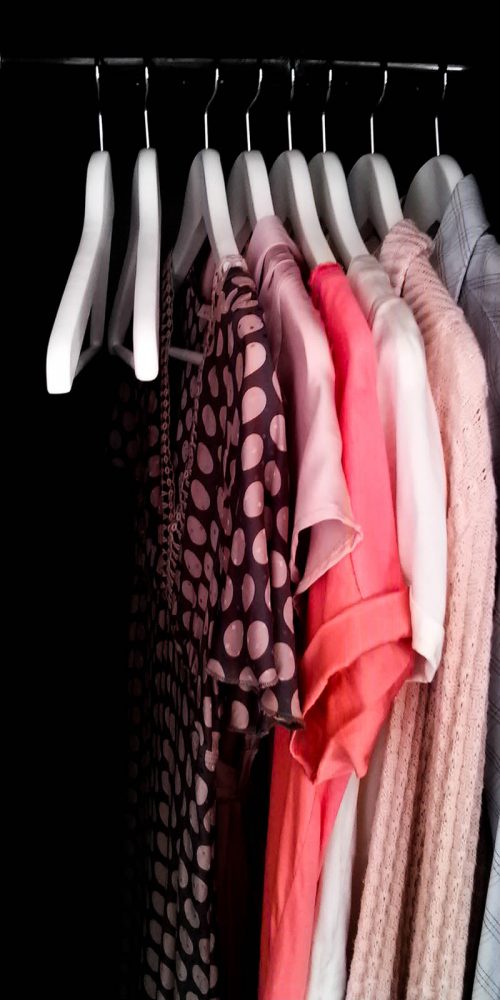
Where is `hangers`? The width and height of the screenshot is (500, 1000). hangers is located at coordinates (107, 178), (133, 180), (201, 187), (260, 187), (306, 198), (326, 194), (374, 188), (442, 190).